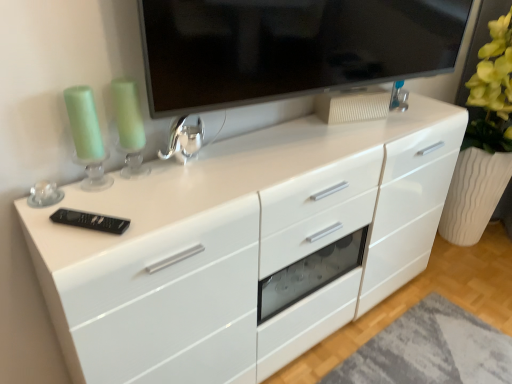
Question: Is matte black tv at upper center directly adjacent to white glossy chest of drawers at center?

Choices:
 (A) no
 (B) yes

Answer: (A)

Question: Can you confirm if matte black tv at upper center is thinner than white glossy chest of drawers at center?

Choices:
 (A) no
 (B) yes

Answer: (B)

Question: Does matte black tv at upper center have a greater width compared to white glossy chest of drawers at center?

Choices:
 (A) yes
 (B) no

Answer: (B)

Question: Does matte black tv at upper center have a greater height compared to white glossy chest of drawers at center?

Choices:
 (A) no
 (B) yes

Answer: (A)

Question: Is matte black tv at upper center to the right of white glossy chest of drawers at center from the viewer's perspective?

Choices:
 (A) no
 (B) yes

Answer: (B)

Question: Is matte black tv at upper center positioned far away from white glossy chest of drawers at center?

Choices:
 (A) no
 (B) yes

Answer: (A)

Question: From a real-world perspective, is matte black tv at upper center located beneath black plastic remote at lower left, which appears as the 2th appliance when viewed from the right?

Choices:
 (A) no
 (B) yes

Answer: (A)

Question: Can we say matte black tv at upper center lies outside black plastic remote at lower left, acting as the 2th appliance starting from the top?

Choices:
 (A) yes
 (B) no

Answer: (A)

Question: Is the surface of matte black tv at upper center in direct contact with black plastic remote at lower left, the 1th appliance ordered from the bottom?

Choices:
 (A) yes
 (B) no

Answer: (B)

Question: Considering the relative sizes of matte black tv at upper center and black plastic remote at lower left, positioned as the second appliance in back-to-front order, in the image provided, is matte black tv at upper center smaller than black plastic remote at lower left, positioned as the second appliance in back-to-front order,?

Choices:
 (A) no
 (B) yes

Answer: (A)

Question: Is matte black tv at upper center oriented towards black plastic remote at lower left, positioned as the second appliance in back-to-front order?

Choices:
 (A) yes
 (B) no

Answer: (B)

Question: Are matte black tv at upper center and black plastic remote at lower left, the 1th appliance in the front-to-back sequence, far apart?

Choices:
 (A) no
 (B) yes

Answer: (A)

Question: Is black plastic remote at lower left, acting as the 2th appliance starting from the top, oriented towards shiny metallic faucet at center, the second appliance positioned from the bottom?

Choices:
 (A) yes
 (B) no

Answer: (B)